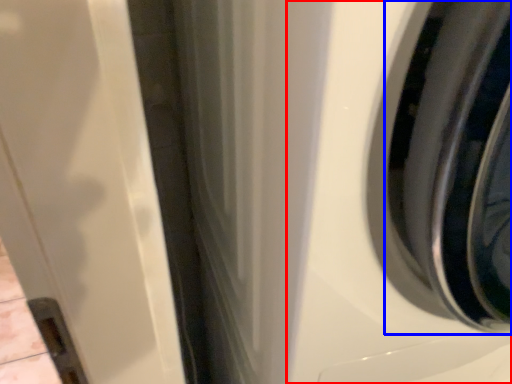
Question: Which object is further to the camera taking this photo, washing machine (highlighted by a red box) or wheel (highlighted by a blue box)?

Choices:
 (A) washing machine
 (B) wheel

Answer: (B)